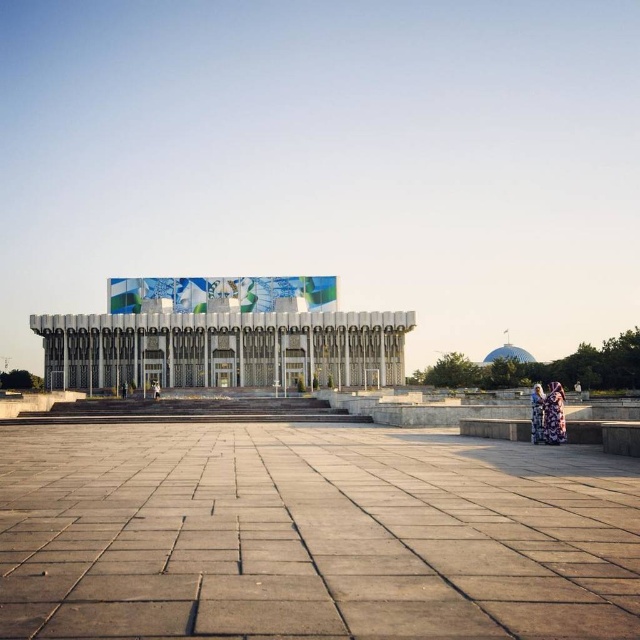
Question: Estimate the real-world distances between objects in this image. Which object is closer to the white glossy building at center?

Choices:
 (A) matte black person at center
 (B) gray concrete plaza at center
 (C) floral dress at lower right
 (D) printed fabric person at lower right

Answer: (A)

Question: Among these points, which one is nearest to the camera?

Choices:
 (A) (561, 396)
 (B) (538, 403)
 (C) (250, 291)
 (D) (156, 388)

Answer: (A)

Question: Does white glossy building at center have a lesser width compared to matte black person at center?

Choices:
 (A) yes
 (B) no

Answer: (B)

Question: Does printed fabric person at lower right have a greater width compared to floral dress at lower right?

Choices:
 (A) no
 (B) yes

Answer: (B)

Question: Can you confirm if printed fabric person at lower right is positioned above floral dress at lower right?

Choices:
 (A) no
 (B) yes

Answer: (B)

Question: Which object is closer to the camera taking this photo?

Choices:
 (A) white glossy building at center
 (B) gray concrete plaza at center
 (C) matte black person at center

Answer: (B)